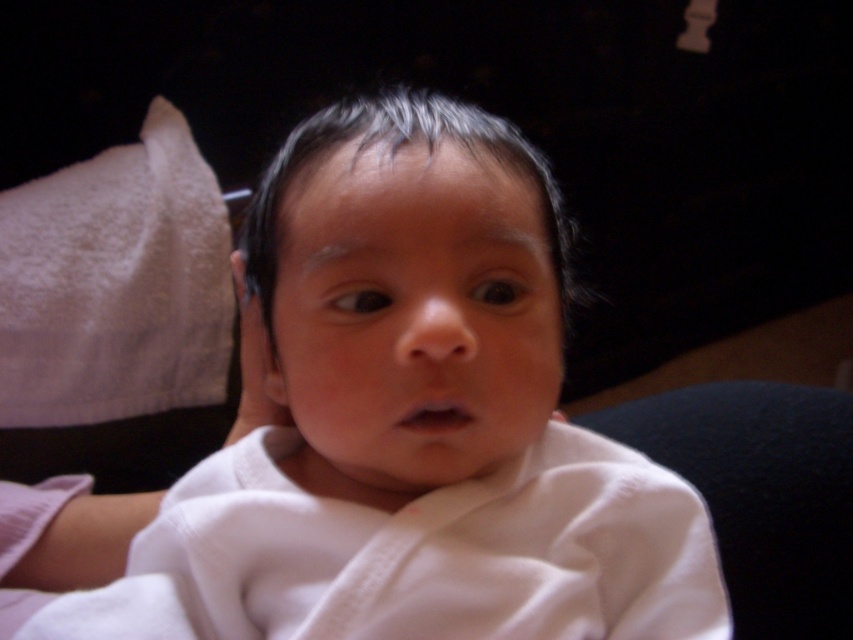
Question: Among these points, which one is farthest from the camera?

Choices:
 (A) (x=235, y=264)
 (B) (x=212, y=627)

Answer: (A)

Question: Which point is closer to the camera?

Choices:
 (A) (354, 522)
 (B) (265, 390)

Answer: (A)

Question: Is white soft cloth at center closer to the viewer compared to white soft cloth at left?

Choices:
 (A) yes
 (B) no

Answer: (A)

Question: Does white soft cloth at center appear on the right side of white soft cloth at left?

Choices:
 (A) yes
 (B) no

Answer: (A)

Question: Does white soft cloth at center have a larger size compared to white soft cloth at left?

Choices:
 (A) yes
 (B) no

Answer: (B)

Question: Which point is closer to the camera?

Choices:
 (A) (268, 392)
 (B) (393, 266)

Answer: (B)